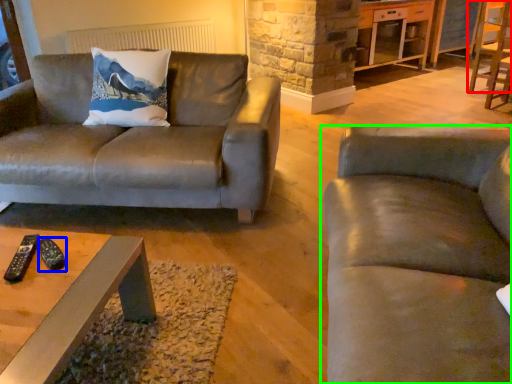
Question: Which is nearer to the chair (highlighted by a red box)? remote (highlighted by a blue box) or studio couch (highlighted by a green box).

Choices:
 (A) remote
 (B) studio couch

Answer: (B)